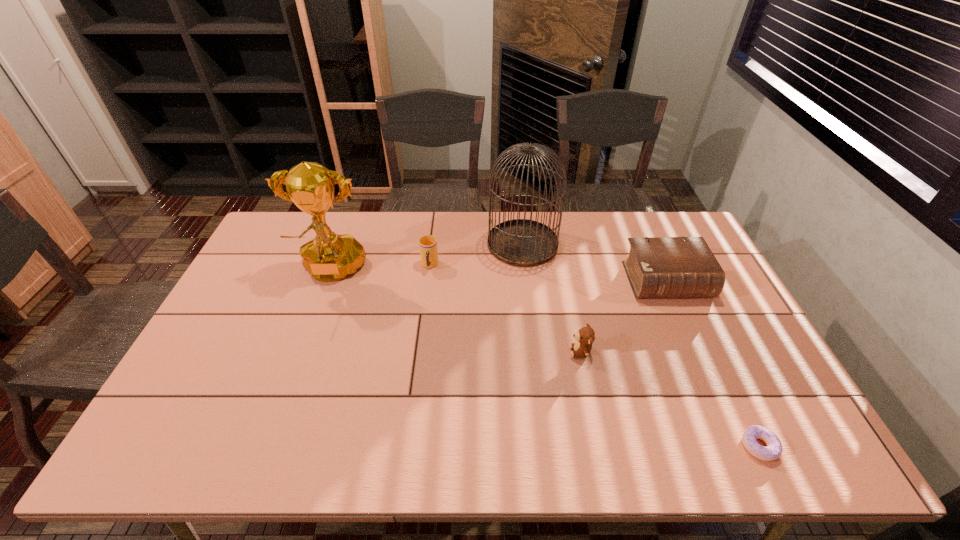
The image size is (960, 540). Identify the location of birdcage. (519, 242).

This screenshot has width=960, height=540. What are the coordinates of `the leftmost object` in the screenshot? It's located at (329, 257).

Locate an element on the screen. This screenshot has height=540, width=960. Bible is located at coordinates (657, 267).

At what (x,y) coordinates should I click in order to perform the action: click on cup. Please return your answer as a coordinate pair (x, y). This screenshot has height=540, width=960. Looking at the image, I should click on (428, 244).

Where is `the second nearest object`? the second nearest object is located at coordinates (585, 337).

You are a GUI agent. You are given a task and a screenshot of the screen. Output one action in this format:
    pyautogui.click(x=<x>, y=<y>)
    Task: Click on the doughnut
    The image size is (960, 540).
    Given the screenshot: What is the action you would take?
    coord(773,450)

You are a GUI agent. You are given a task and a screenshot of the screen. Output one action in this format:
    pyautogui.click(x=<x>, y=<y>)
    Task: Click on the nearest object
    The height and width of the screenshot is (540, 960).
    Given the screenshot: What is the action you would take?
    pyautogui.click(x=773, y=450)

Locate an element on the screen. Image resolution: width=960 pixels, height=540 pixels. free spot located 0.200m on the front of the birdcage is located at coordinates (x=530, y=311).

Locate an element on the screen. Image resolution: width=960 pixels, height=540 pixels. free space located on the front side of the award is located at coordinates (307, 337).

Identify the location of free space located 0.090m on the spine side of the Bible. The width and height of the screenshot is (960, 540). (686, 325).